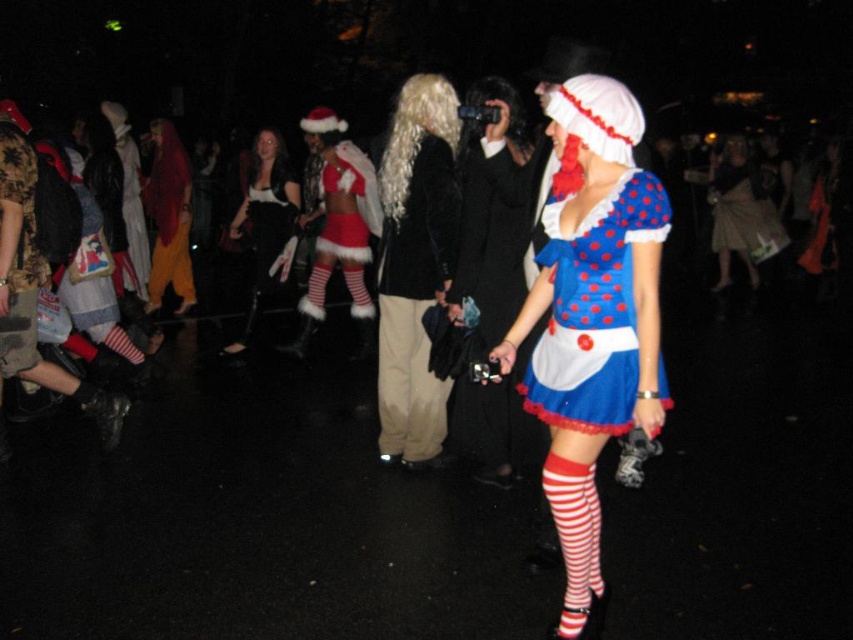
You are at the costume party and want to take a photo of the beige cotton pants at center and the blonde curly wig at center. Which one should you point your camera towards first if you are standing to the right of both objects?

You should point your camera towards the beige cotton pants at center first because it is to the left of the blonde curly wig at center, so when standing to the right, the beige cotton pants at center will be further to your left and thus require aiming in that direction first before adjusting to capture the blonde curly wig at center.

Consider the image. You are a photographer at the costume party. You need to capture a group photo of the beige cotton pants at center and velvet black dress at center. Which of the two requires a wider frame to fit properly?

The velvet black dress at center requires a wider frame because its width is greater than the beige cotton pants at center.